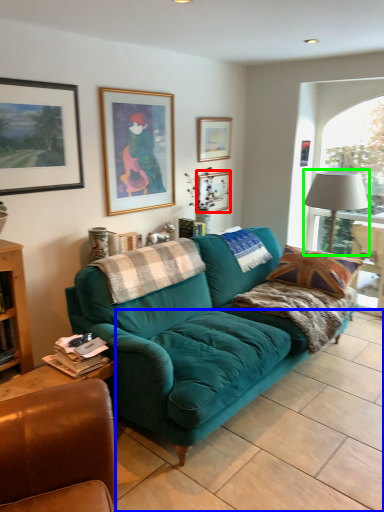
Question: Which is farther away from picture frame (highlighted by a red box)? tile (highlighted by a blue box) or lamp (highlighted by a green box)?

Choices:
 (A) tile
 (B) lamp

Answer: (A)